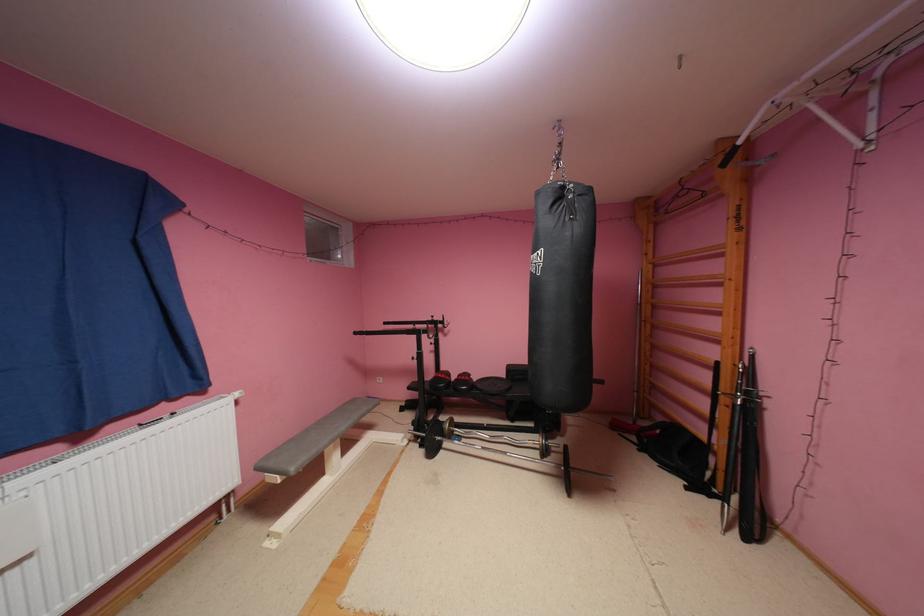
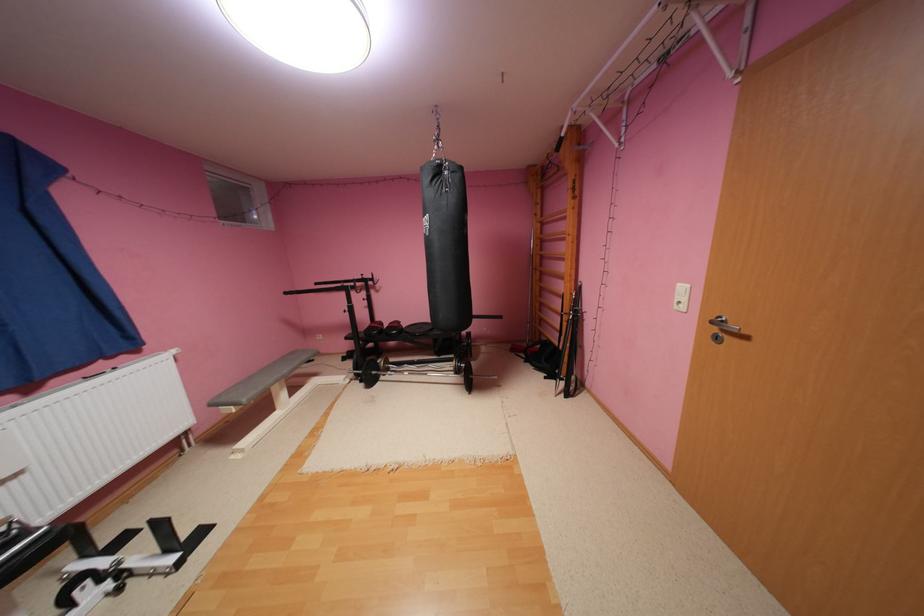
Find the pixel in the second image that matches point 748,142 in the first image.

(572, 135)